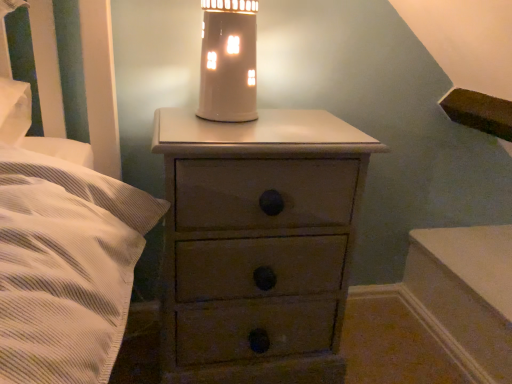
Image resolution: width=512 pixels, height=384 pixels. In order to click on matte white oil lamp at upper center in this screenshot , I will do `click(228, 61)`.

Describe the element at coordinates (228, 61) in the screenshot. I see `matte white oil lamp at upper center` at that location.

Where is `matte brown chest of drawers at center`? The height and width of the screenshot is (384, 512). matte brown chest of drawers at center is located at coordinates (258, 245).

Measure the distance between matte brown chest of drawers at center and camera.

29.58 inches.

Describe the element at coordinates (258, 245) in the screenshot. I see `matte brown chest of drawers at center` at that location.

Find the location of `matte white oil lamp at upper center`. matte white oil lamp at upper center is located at coordinates (228, 61).

Between matte white oil lamp at upper center and matte brown chest of drawers at center, which one appears on the left side from the viewer's perspective?

Positioned to the left is matte white oil lamp at upper center.

Considering their positions, is matte white oil lamp at upper center located in front of or behind matte brown chest of drawers at center?

Visually, matte white oil lamp at upper center is located behind matte brown chest of drawers at center.

Is point (250, 22) closer or farther from the camera than point (322, 356)?

Point (250, 22) appears to be closer to the viewer than point (322, 356).

From the picture: From the image's perspective, which one is positioned higher, matte white oil lamp at upper center or matte brown chest of drawers at center?

matte white oil lamp at upper center.

From a real-world perspective, is matte white oil lamp at upper center beneath matte brown chest of drawers at center?

Incorrect, from a real-world perspective, matte white oil lamp at upper center is higher than matte brown chest of drawers at center.

Which object is wider, matte white oil lamp at upper center or matte brown chest of drawers at center?

matte brown chest of drawers at center.

From the picture: Between matte white oil lamp at upper center and matte brown chest of drawers at center, which one has more height?

matte brown chest of drawers at center is taller.

Does matte white oil lamp at upper center have a smaller size compared to matte brown chest of drawers at center?

Yes, matte white oil lamp at upper center is smaller than matte brown chest of drawers at center.

Is matte brown chest of drawers at center completely or partially inside matte white oil lamp at upper center?

No, matte white oil lamp at upper center does not contain matte brown chest of drawers at center.

Is matte white oil lamp at upper center with matte brown chest of drawers at center?

No, matte white oil lamp at upper center is not in contact with matte brown chest of drawers at center.

Does matte white oil lamp at upper center turn towards matte brown chest of drawers at center?

No, matte white oil lamp at upper center is not facing towards matte brown chest of drawers at center.

Measure the distance from matte white oil lamp at upper center to matte brown chest of drawers at center.

matte white oil lamp at upper center is 11.21 inches away from matte brown chest of drawers at center.

You are a GUI agent. You are given a task and a screenshot of the screen. Output one action in this format:
    pyautogui.click(x=<x>, y=<y>)
    Task: Click on the chest of drawers below the matte white oil lamp at upper center (from the image's perspective)
    The image size is (512, 384).
    Given the screenshot: What is the action you would take?
    pyautogui.click(x=258, y=245)

Which object is positioned more to the left, matte brown chest of drawers at center or matte white oil lamp at upper center?

matte white oil lamp at upper center is more to the left.

Considering the positions of objects matte brown chest of drawers at center and matte white oil lamp at upper center in the image provided, who is in front, matte brown chest of drawers at center or matte white oil lamp at upper center?

Positioned in front is matte brown chest of drawers at center.

Considering the positions of point (276, 352) and point (241, 84), is point (276, 352) closer or farther from the camera than point (241, 84)?

Point (276, 352).

From the image's perspective, is matte brown chest of drawers at center located above or below matte white oil lamp at upper center?

matte brown chest of drawers at center is below matte white oil lamp at upper center.

From a real-world perspective, is matte brown chest of drawers at center positioned above or below matte white oil lamp at upper center?

In terms of real-world spatial position, matte brown chest of drawers at center is below matte white oil lamp at upper center.

Can you confirm if matte brown chest of drawers at center is thinner than matte white oil lamp at upper center?

No.

In terms of height, does matte brown chest of drawers at center look taller or shorter compared to matte white oil lamp at upper center?

Considering their sizes, matte brown chest of drawers at center has more height than matte white oil lamp at upper center.

Based on the photo, can you confirm if matte brown chest of drawers at center is bigger than matte white oil lamp at upper center?

Indeed, matte brown chest of drawers at center has a larger size compared to matte white oil lamp at upper center.

Would you say matte brown chest of drawers at center is outside matte white oil lamp at upper center?

That's correct, matte brown chest of drawers at center is outside of matte white oil lamp at upper center.

Is matte brown chest of drawers at center positioned far away from matte white oil lamp at upper center?

They are positioned close to each other.

Is matte brown chest of drawers at center turned away from matte white oil lamp at upper center?

No, matte brown chest of drawers at center's orientation is not away from matte white oil lamp at upper center.

Where is `chest of drawers below the matte white oil lamp at upper center (from a real-world perspective)`? This screenshot has height=384, width=512. chest of drawers below the matte white oil lamp at upper center (from a real-world perspective) is located at coordinates (258, 245).

You are a GUI agent. You are given a task and a screenshot of the screen. Output one action in this format:
    pyautogui.click(x=<x>, y=<y>)
    Task: Click on the oil lamp behind the matte brown chest of drawers at center
    
    Given the screenshot: What is the action you would take?
    pyautogui.click(x=228, y=61)

Locate an element on the screen. This screenshot has height=384, width=512. oil lamp lying above the matte brown chest of drawers at center (from the image's perspective) is located at coordinates (228, 61).